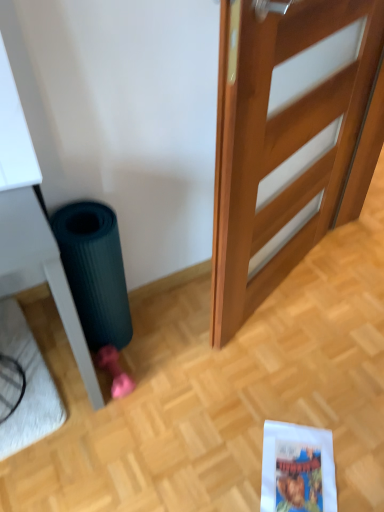
Locate an element on the screen. Image resolution: width=384 pixels, height=512 pixels. vacant space underneath blue glossy comic book at lower right (from a real-world perspective) is located at coordinates (300, 473).